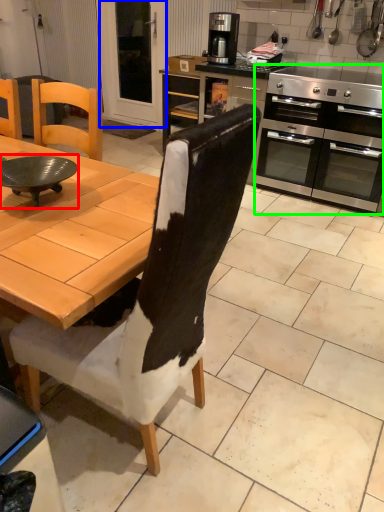
Question: Which object is positioned closest to round table (highlighted by a red box)? Select from screen door (highlighted by a blue box) and kitchen appliance (highlighted by a green box).

Choices:
 (A) screen door
 (B) kitchen appliance

Answer: (B)